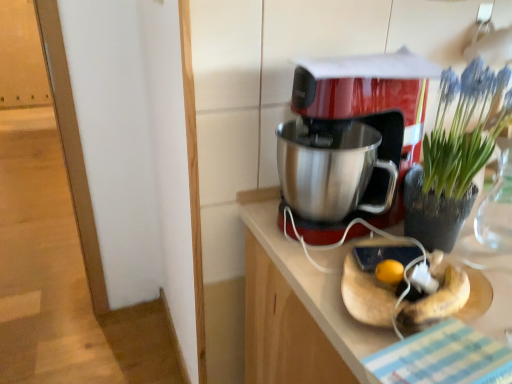
Question: Can you confirm if metallic red coffee maker at center is positioned to the right of stainless steel countertop at center?

Choices:
 (A) no
 (B) yes

Answer: (A)

Question: From the image's perspective, is metallic red coffee maker at center over stainless steel countertop at center?

Choices:
 (A) no
 (B) yes

Answer: (B)

Question: Considering the relative sizes of metallic red coffee maker at center and stainless steel countertop at center in the image provided, is metallic red coffee maker at center wider than stainless steel countertop at center?

Choices:
 (A) no
 (B) yes

Answer: (A)

Question: Is metallic red coffee maker at center facing away from stainless steel countertop at center?

Choices:
 (A) yes
 (B) no

Answer: (B)

Question: Does metallic red coffee maker at center have a larger size compared to stainless steel countertop at center?

Choices:
 (A) no
 (B) yes

Answer: (A)

Question: Is point (246, 314) closer or farther from the camera than point (373, 200)?

Choices:
 (A) farther
 (B) closer

Answer: (A)

Question: Would you say stainless steel countertop at center is to the left or to the right of metallic red coffee maker at center in the picture?

Choices:
 (A) left
 (B) right

Answer: (B)

Question: Looking at the image, does stainless steel countertop at center seem bigger or smaller compared to metallic red coffee maker at center?

Choices:
 (A) big
 (B) small

Answer: (A)

Question: Which is correct: stainless steel countertop at center is inside metallic red coffee maker at center, or outside of it?

Choices:
 (A) outside
 (B) inside

Answer: (A)

Question: Considering their positions, is metallic red coffee maker at center located in front of or behind green leafy plant at upper right?

Choices:
 (A) behind
 (B) front

Answer: (A)

Question: Is point (335, 97) positioned closer to the camera than point (486, 105)?

Choices:
 (A) closer
 (B) farther

Answer: (B)

Question: Do you think metallic red coffee maker at center is within green leafy plant at upper right, or outside of it?

Choices:
 (A) outside
 (B) inside

Answer: (A)

Question: Looking at their shapes, would you say metallic red coffee maker at center is wider or thinner than green leafy plant at upper right?

Choices:
 (A) wide
 (B) thin

Answer: (A)

Question: From a real-world perspective, relative to stainless steel countertop at center, is green leafy plant at upper right vertically above or below?

Choices:
 (A) above
 (B) below

Answer: (A)

Question: Is green leafy plant at upper right to the left or to the right of stainless steel countertop at center in the image?

Choices:
 (A) left
 (B) right

Answer: (B)